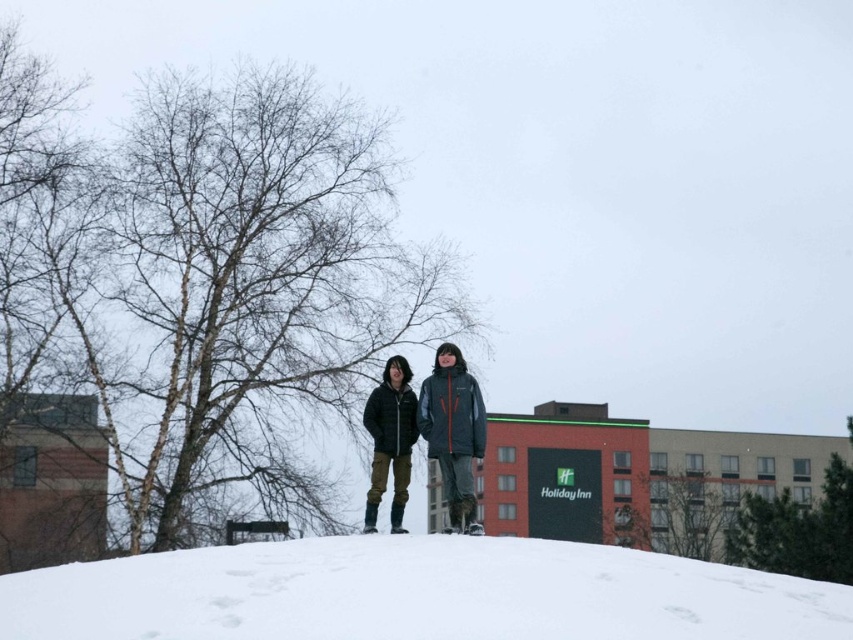
You are a photographer trying to capture the two people standing on the snow. Based on the scene, which object is closer to you, the photographer, when you look through the camera lens? The white fluffy snow at center or the matte black jacket at center?

The white fluffy snow at center is closer to the photographer than the matte black jacket at center.

You are a hiker who wants to take a photo of the Holiday Inn sign in the background. You notice the white fluffy snow at center and the matte black jacket at center. Which object should you focus on to ensure the Holiday Inn sign is in the background?

You should focus on the matte black jacket at center because the white fluffy snow at center is below it, meaning the jacket is closer to you than the snow. Since the Holiday Inn is in the background, focusing on the jacket will keep the sign in the background.